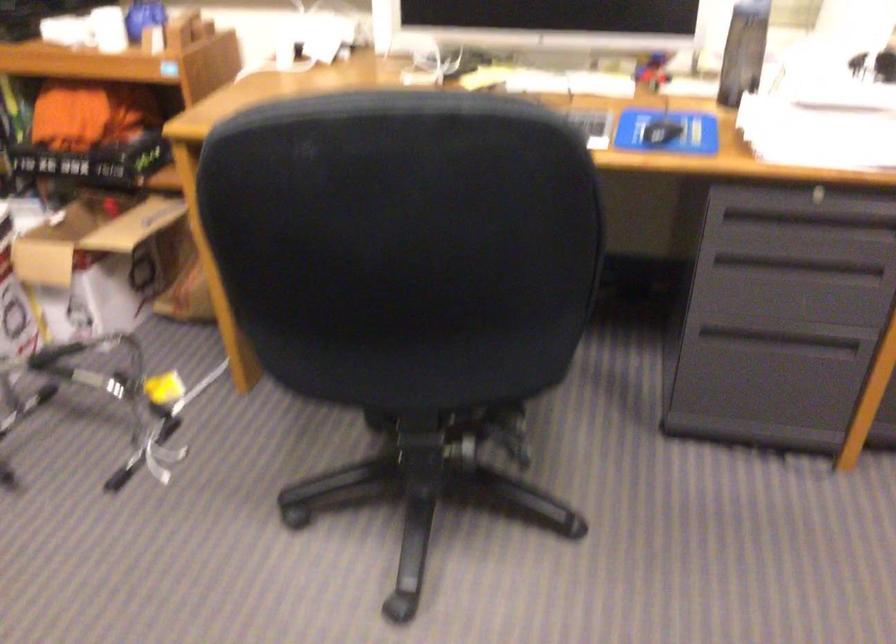
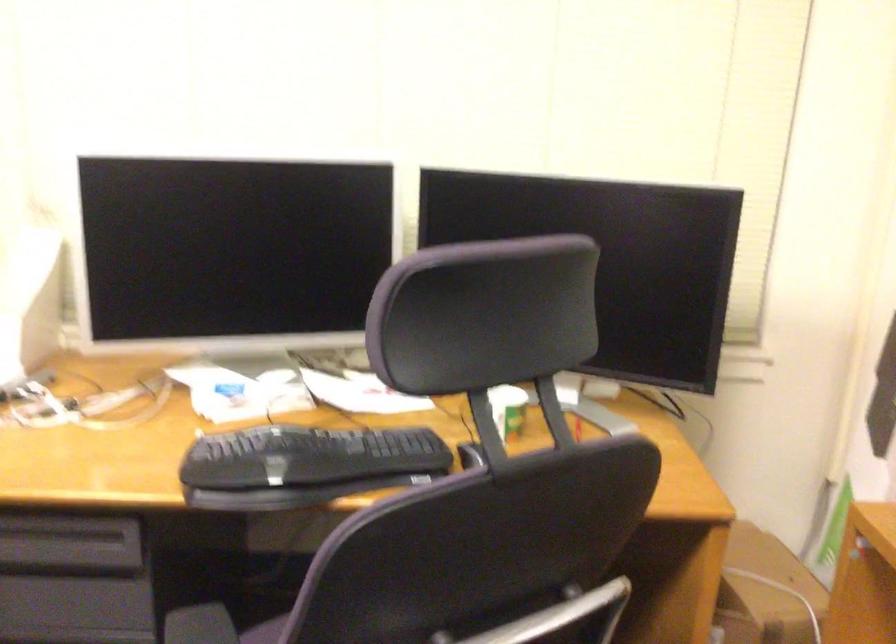
Question: In a continuous first-person perspective shot, in which direction is the camera moving?

Choices:
 (A) Left
 (B) Right
 (C) Forward
 (D) Backward

Answer: (B)